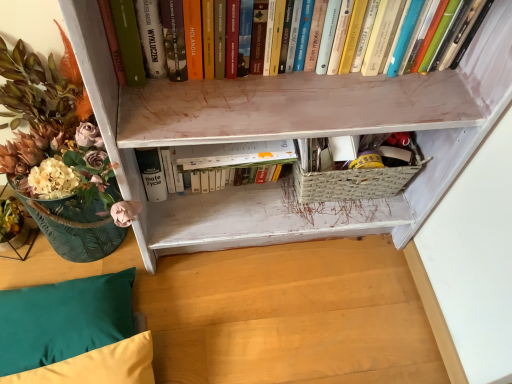
Question: Does hardcover books at upper center, placed as the 1th book when sorted from front to back, appear on the left side of velvet yellow pillow at lower left, placed as the first pillow when sorted from bottom to top?

Choices:
 (A) no
 (B) yes

Answer: (A)

Question: Is hardcover books at upper center, the 2th book when ordered from bottom to top, next to velvet yellow pillow at lower left, placed as the 2th pillow when sorted from top to bottom, and touching it?

Choices:
 (A) yes
 (B) no

Answer: (B)

Question: Would you say hardcover books at upper center, which is the second book from back to front, is a long distance from velvet yellow pillow at lower left, placed as the first pillow when sorted from bottom to top?

Choices:
 (A) yes
 (B) no

Answer: (B)

Question: Does hardcover books at upper center, the 2th book when ordered from bottom to top, have a larger size compared to velvet yellow pillow at lower left, placed as the 2th pillow when sorted from top to bottom?

Choices:
 (A) no
 (B) yes

Answer: (B)

Question: Is velvet yellow pillow at lower left, placed as the 2th pillow when sorted from top to bottom, inside hardcover books at upper center, the 1th book viewed from the top?

Choices:
 (A) yes
 (B) no

Answer: (B)

Question: From their relative heights in the image, would you say white matte book at center, which ranks as the 2th book in front-to-back order, is taller or shorter than teal fabric pillow at lower left, placed as the 2th pillow when sorted from bottom to top?

Choices:
 (A) tall
 (B) short

Answer: (A)

Question: Is white matte book at center, the 1th book from the back, to the left or to the right of teal fabric pillow at lower left, placed as the 2th pillow when sorted from bottom to top, in the image?

Choices:
 (A) right
 (B) left

Answer: (A)

Question: From a real-world perspective, relative to teal fabric pillow at lower left, placed as the 2th pillow when sorted from bottom to top, is white matte book at center, which ranks as the 2th book in front-to-back order, vertically above or below?

Choices:
 (A) below
 (B) above

Answer: (B)

Question: Is point (221, 150) closer or farther from the camera than point (39, 354)?

Choices:
 (A) farther
 (B) closer

Answer: (A)

Question: In terms of width, does translucent glass vase at left look wider or thinner when compared to velvet yellow pillow at lower left, placed as the 2th pillow when sorted from top to bottom?

Choices:
 (A) thin
 (B) wide

Answer: (B)

Question: In terms of size, does translucent glass vase at left appear bigger or smaller than velvet yellow pillow at lower left, placed as the first pillow when sorted from bottom to top?

Choices:
 (A) big
 (B) small

Answer: (A)

Question: From the image's perspective, relative to velvet yellow pillow at lower left, placed as the first pillow when sorted from bottom to top, is translucent glass vase at left above or below?

Choices:
 (A) above
 (B) below

Answer: (A)

Question: In terms of height, does translucent glass vase at left look taller or shorter compared to velvet yellow pillow at lower left, placed as the 2th pillow when sorted from top to bottom?

Choices:
 (A) tall
 (B) short

Answer: (A)

Question: Would you say hardcover books at upper center, the 1th book viewed from the top, is inside or outside woven straw basket at lower center?

Choices:
 (A) outside
 (B) inside

Answer: (A)

Question: From the image's perspective, is hardcover books at upper center, the 2th book when ordered from bottom to top, positioned above or below woven straw basket at lower center?

Choices:
 (A) below
 (B) above

Answer: (B)